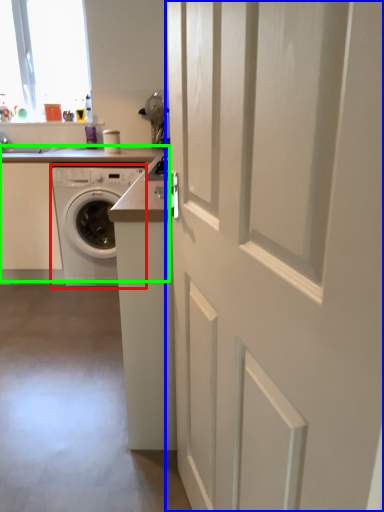
Question: Which object is the farthest from washing machine (highlighted by a red box)? Choose among these: door (highlighted by a blue box) or appliance (highlighted by a green box).

Choices:
 (A) door
 (B) appliance

Answer: (A)